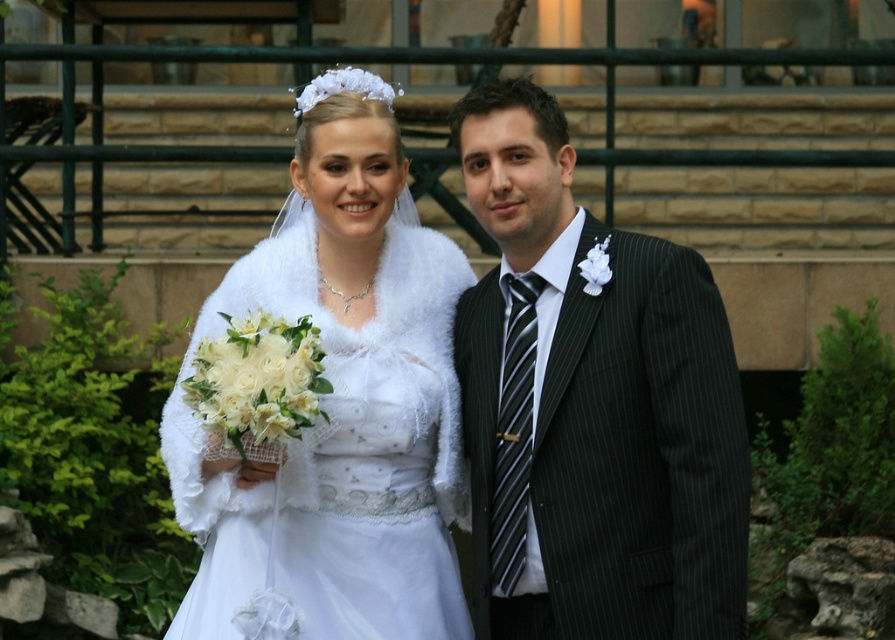
Is matte black suit at right bigger than white fur shawl at center?

Actually, matte black suit at right might be smaller than white fur shawl at center.

Which is more to the right, matte black suit at right or white fur shawl at center?

From the viewer's perspective, matte black suit at right appears more on the right side.

Is point (533, 256) positioned behind point (339, 557)?

Yes, it is.

Locate an element on the screen. The image size is (895, 640). matte black suit at right is located at coordinates (591, 404).